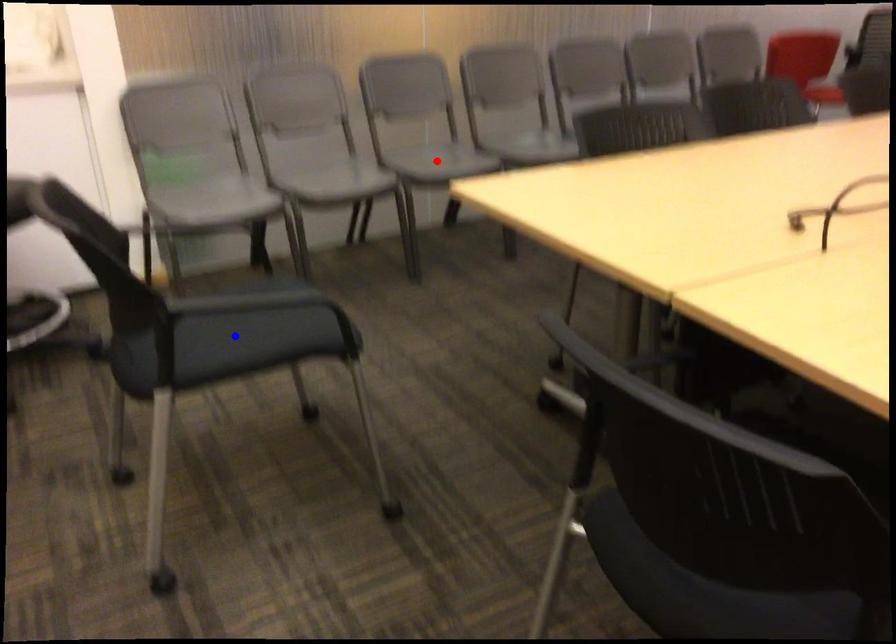
Question: Which of the two points in the image is closer to the camera?

Choices:
 (A) Blue point is closer.
 (B) Red point is closer.

Answer: (A)